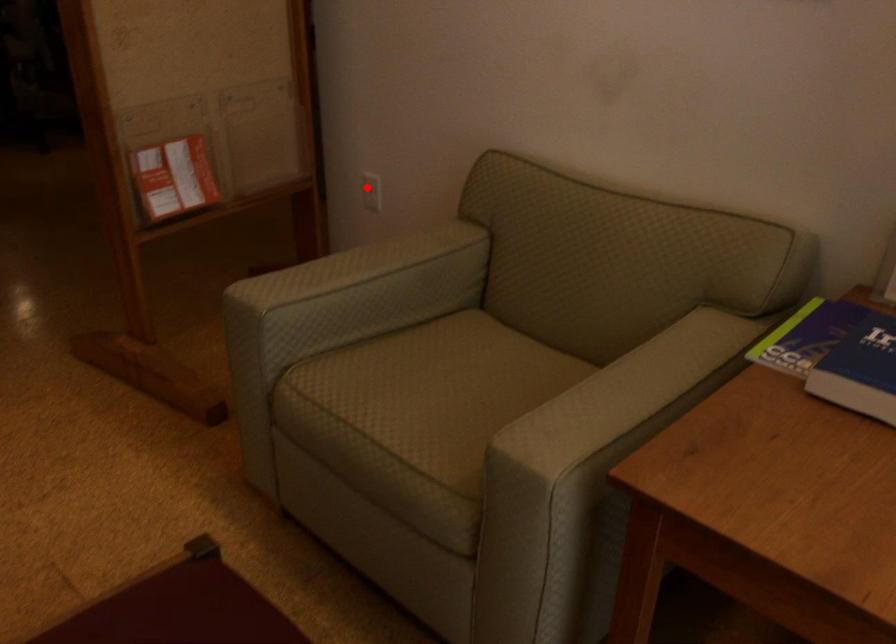
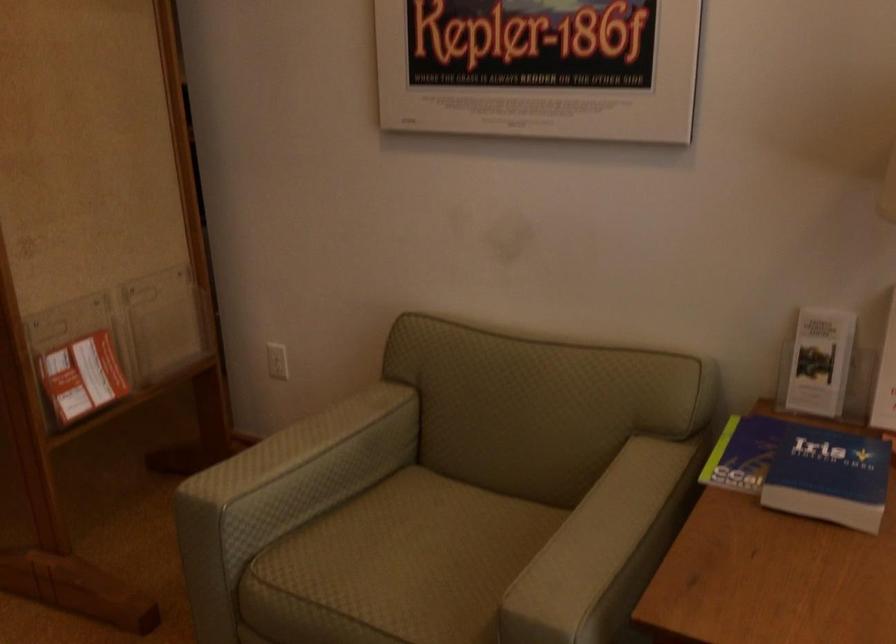
Where in the second image is the point corresponding to the highlighted location from the first image?

(277, 361)